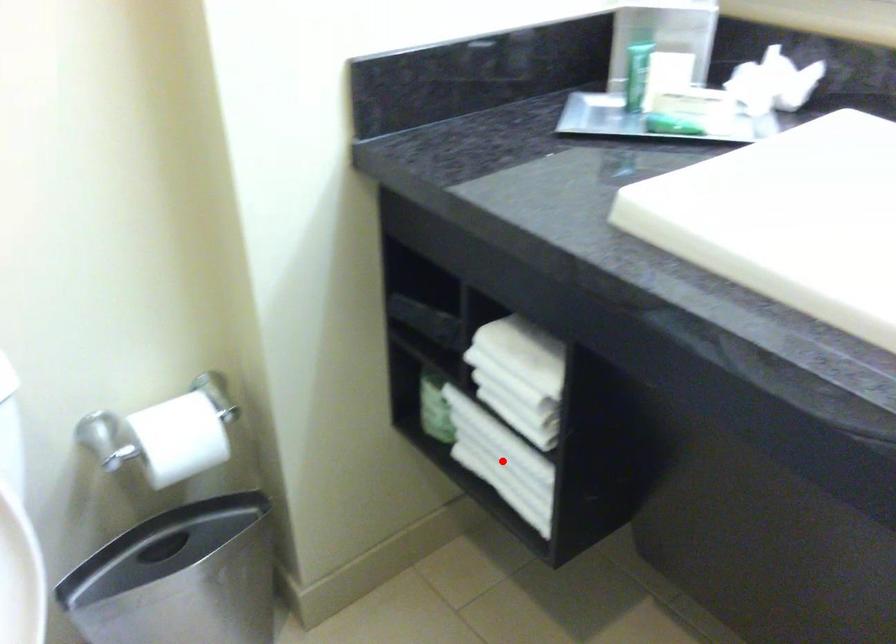
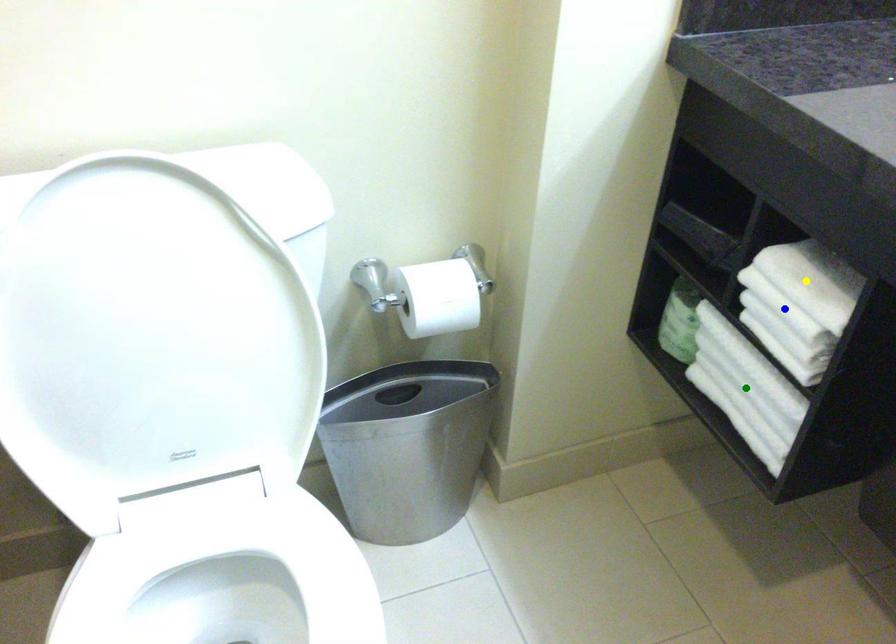
Question: I am providing you with two images of the same scene from different viewpoints. A red point is marked on the first image. You are given multiple points on the second image. Which point in image 2 represents the same 3d spot as the red point in image 1?

Choices:
 (A) green point
 (B) yellow point
 (C) blue point

Answer: (A)